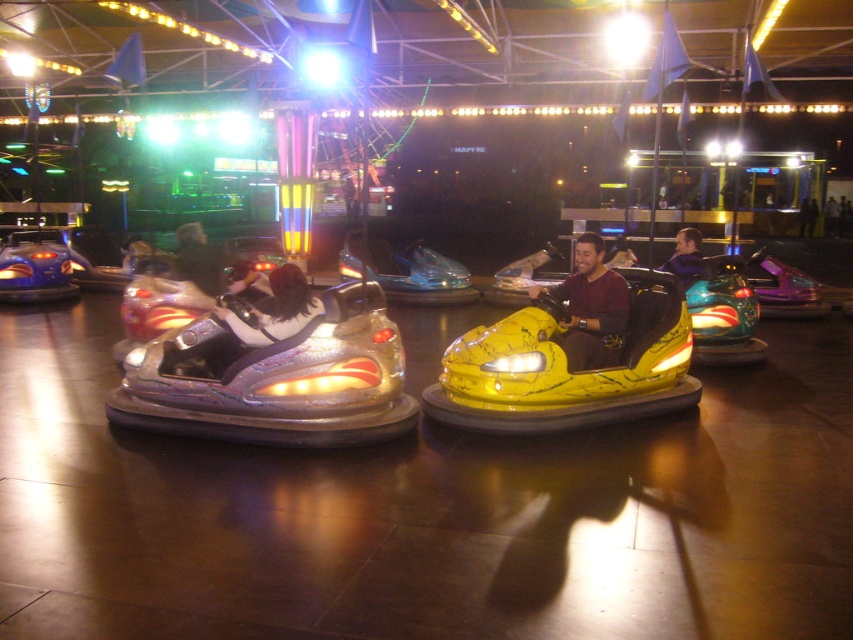
Question: Can you confirm if shiny silver bumper car at left is positioned to the left of shiny silver helmet at center?

Choices:
 (A) no
 (B) yes

Answer: (A)

Question: Is maroon jersey at center thinner than shiny silver helmet at center?

Choices:
 (A) no
 (B) yes

Answer: (B)

Question: Is shiny silver bumper car at left bigger than shiny silver helmet at center?

Choices:
 (A) no
 (B) yes

Answer: (A)

Question: Among these points, which one is nearest to the camera?

Choices:
 (A) (241, 316)
 (B) (676, 269)
 (C) (181, 240)
 (D) (590, 234)

Answer: (A)

Question: Among these objects, which one is nearest to the camera?

Choices:
 (A) maroon jersey at center
 (B) shiny silver bumper car at left

Answer: (B)

Question: Based on their relative distances, which object is farther from the maroon jersey at center?

Choices:
 (A) shiny silver bumper car at left
 (B) purple matte jacket at center

Answer: (B)